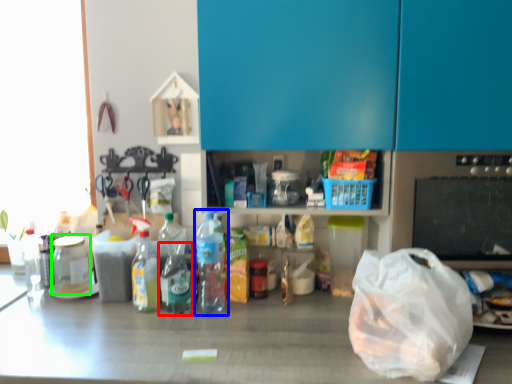
Question: Which is nearer to the bottle (highlighted by a red box)? bottle (highlighted by a blue box) or bottle (highlighted by a green box).

Choices:
 (A) bottle
 (B) bottle

Answer: (A)